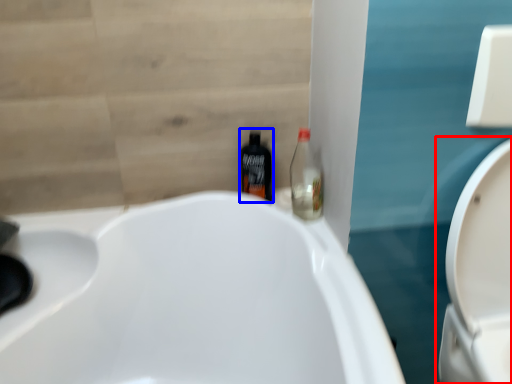
Question: Which object is closer to the camera taking this photo, toilet (highlighted by a red box) or bottle (highlighted by a blue box)?

Choices:
 (A) toilet
 (B) bottle

Answer: (A)